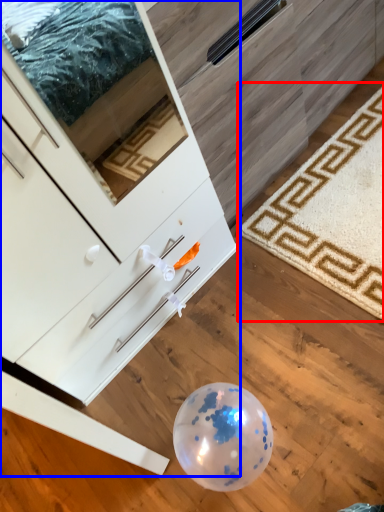
Question: Which object is further to the camera taking this photo, mat (highlighted by a red box) or chest of drawers (highlighted by a blue box)?

Choices:
 (A) mat
 (B) chest of drawers

Answer: (A)